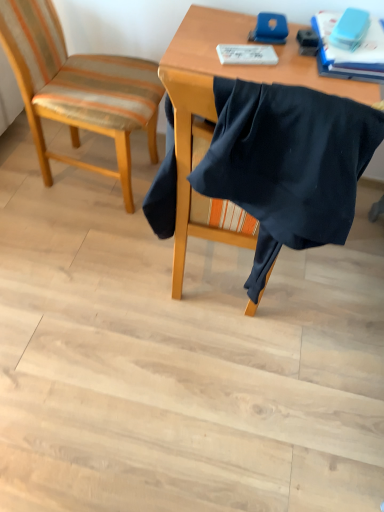
Image resolution: width=384 pixels, height=512 pixels. What are the coordinates of `free spot in front of striped fabric chair at left, placed as the 2th chair when sorted from right to left` in the screenshot? It's located at (77, 246).